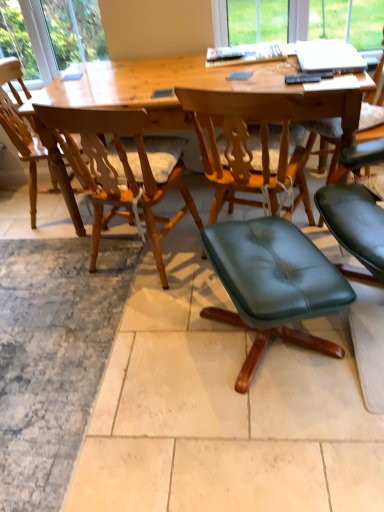
Question: Is green leather ottoman at center, placed as the 4th chair when sorted from left to right, not inside wooden chair at center, acting as the 3th chair starting from the right?

Choices:
 (A) yes
 (B) no

Answer: (A)

Question: From a real-world perspective, does green leather ottoman at center, placed as the 1th chair when sorted from right to left, stand above wooden chair at center, acting as the 3th chair starting from the right?

Choices:
 (A) no
 (B) yes

Answer: (A)

Question: Does green leather ottoman at center, placed as the 4th chair when sorted from left to right, appear on the left side of wooden chair at center, acting as the 3th chair starting from the right?

Choices:
 (A) no
 (B) yes

Answer: (A)

Question: Considering the relative sizes of green leather ottoman at center, placed as the 1th chair when sorted from right to left, and wooden chair at center, which is the second chair from left to right, in the image provided, is green leather ottoman at center, placed as the 1th chair when sorted from right to left, shorter than wooden chair at center, which is the second chair from left to right,?

Choices:
 (A) no
 (B) yes

Answer: (B)

Question: Is green leather ottoman at center, placed as the 1th chair when sorted from right to left, with wooden chair at center, acting as the 3th chair starting from the right?

Choices:
 (A) no
 (B) yes

Answer: (A)

Question: Is the position of green leather ottoman at center, placed as the 4th chair when sorted from left to right, less distant than that of wooden chair at center, which is the second chair from left to right?

Choices:
 (A) no
 (B) yes

Answer: (B)

Question: From a real-world perspective, is light wood chair at center, which is the 1th chair from left to right, positioned under green leather ottoman at lower right, marked as the 2th chair in a right-to-left arrangement, based on gravity?

Choices:
 (A) yes
 (B) no

Answer: (B)

Question: Is light wood chair at center, which is the 1th chair from left to right, outside of green leather ottoman at lower right, the 3th chair when ordered from left to right?

Choices:
 (A) yes
 (B) no

Answer: (A)

Question: From the image's perspective, is light wood chair at center, the 4th chair from the right, under green leather ottoman at lower right, the 3th chair when ordered from left to right?

Choices:
 (A) no
 (B) yes

Answer: (A)

Question: Considering the relative sizes of light wood chair at center, which is the 1th chair from left to right, and green leather ottoman at lower right, the 3th chair when ordered from left to right, in the image provided, is light wood chair at center, which is the 1th chair from left to right, thinner than green leather ottoman at lower right, the 3th chair when ordered from left to right,?

Choices:
 (A) no
 (B) yes

Answer: (A)

Question: Considering the relative positions of light wood chair at center, which is the 1th chair from left to right, and green leather ottoman at lower right, the 3th chair when ordered from left to right, in the image provided, is light wood chair at center, which is the 1th chair from left to right, behind green leather ottoman at lower right, the 3th chair when ordered from left to right,?

Choices:
 (A) yes
 (B) no

Answer: (A)

Question: Is light wood chair at center, the 4th chair from the right, positioned before green leather ottoman at lower right, marked as the 2th chair in a right-to-left arrangement?

Choices:
 (A) no
 (B) yes

Answer: (A)

Question: Are green leather ottoman at lower right, the 3th chair when ordered from left to right, and light wood chair at center, which is the 1th chair from left to right, located far from each other?

Choices:
 (A) no
 (B) yes

Answer: (B)